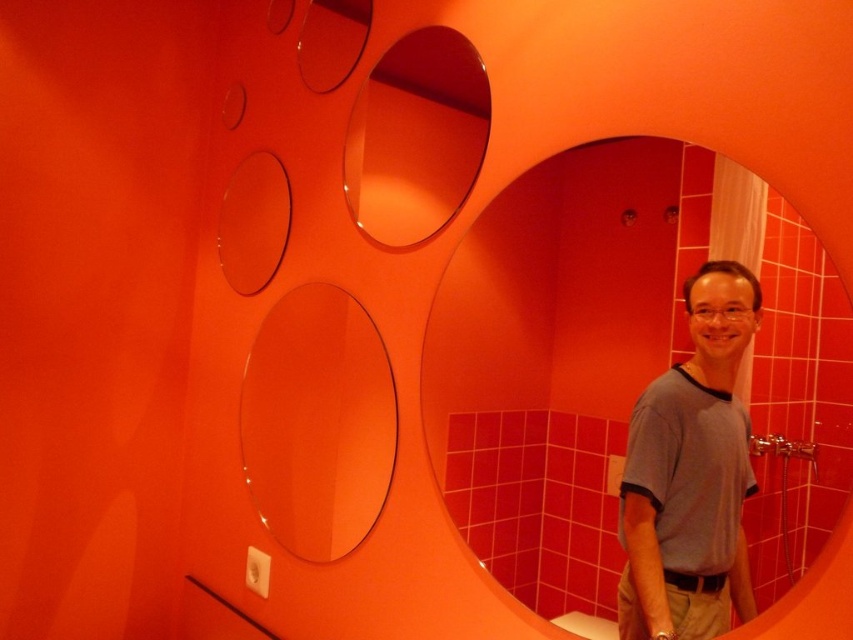
You are designing a bathroom layout and need to place a decorative plant between the transparent glass mirror at center and the transparent glass oval at center. Which object should the plant be closer to if it must be placed closer to the wider object?

The transparent glass mirror at center is wider than the transparent glass oval at center, so the plant should be placed closer to the transparent glass mirror at center.

You are trying to hang a thin hanger on the wall in the bathroom. You see the gray cotton shirt at center and the transparent glass mirror at upper center. Which object can the hanger be attached to?

The transparent glass mirror at upper center can have the hanger attached to it since it is thicker than the gray cotton shirt at center.

You are standing in the bathroom and want to hand a towel to the person wearing the gray cotton shirt at center. If you can reach up to 1 meter, will you be able to hand it to them without moving closer?

The gray cotton shirt at center is 86.77 centimeters away from the viewer. Since your reach is up to 1 meter, you can hand the towel to them without moving closer.